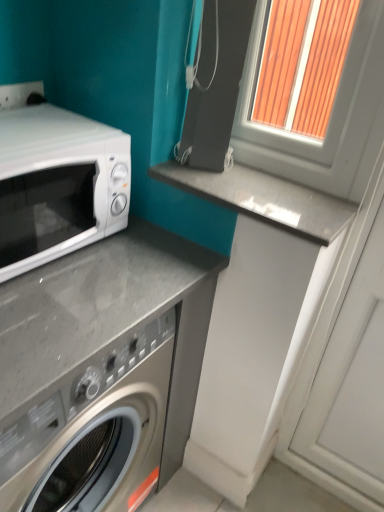
Locate an element on the screen. Image resolution: width=384 pixels, height=512 pixels. empty space that is ontop of white glossy microwave at left (from a real-world perspective) is located at coordinates (35, 124).